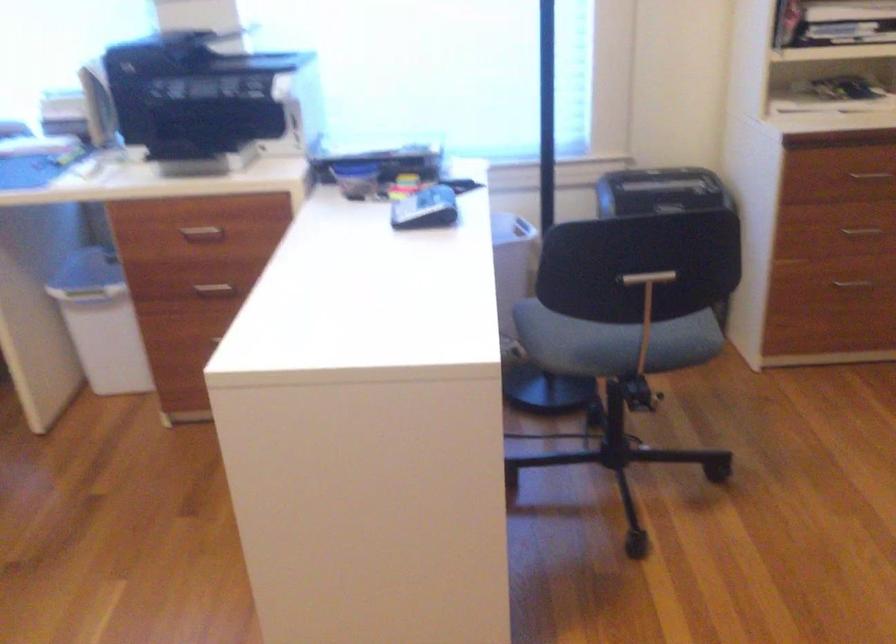
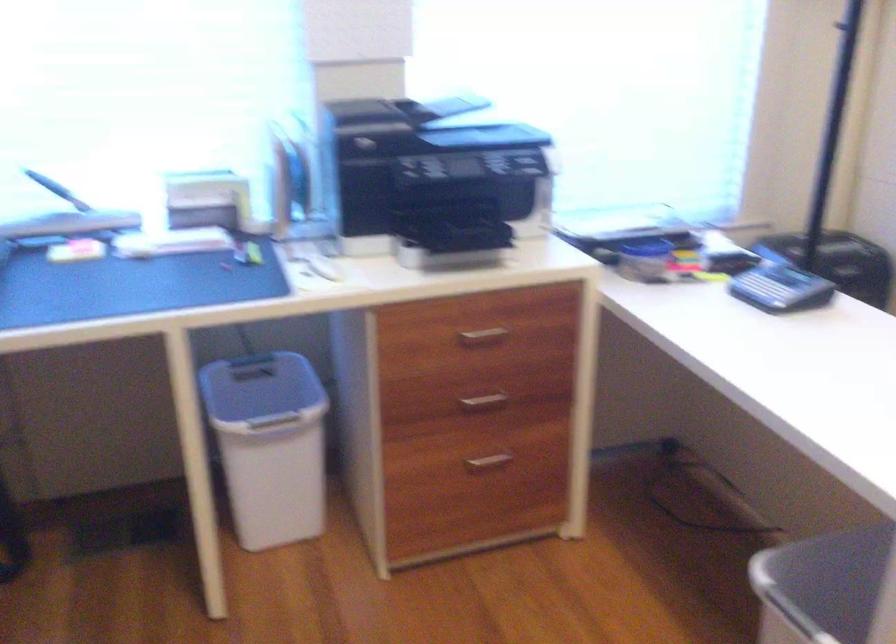
In the second image, find the point that corresponds to pixel 224 286 in the first image.

(484, 401)